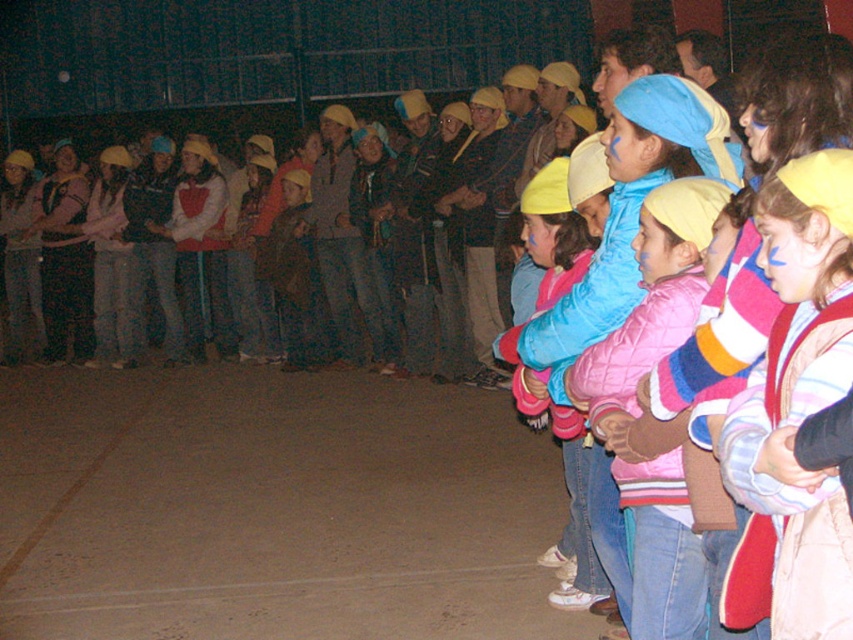
Is striped fleece jacket at center to the right of pink quilted jacket at center from the viewer's perspective?

Indeed, striped fleece jacket at center is positioned on the right side of pink quilted jacket at center.

What do you see at coordinates (795, 412) in the screenshot? The width and height of the screenshot is (853, 640). I see `striped fleece jacket at center` at bounding box center [795, 412].

The image size is (853, 640). I want to click on striped fleece jacket at center, so click(x=795, y=412).

Between matte blue jacket at center and brown concrete floor at lower center, which one appears on the right side from the viewer's perspective?

matte blue jacket at center

Is matte blue jacket at center taller than brown concrete floor at lower center?

Yes.

Consider the image. Who is more distant from viewer, (550, 230) or (65, 600)?

Positioned behind is point (65, 600).

Find the location of a particular element. matte blue jacket at center is located at coordinates (566, 488).

Is striped fleece jacket at center further to camera compared to matte blue jacket at center?

No, it is not.

Does striped fleece jacket at center lie in front of matte blue jacket at center?

Yes, striped fleece jacket at center is closer to the viewer.

Where is `striped fleece jacket at center`? Image resolution: width=853 pixels, height=640 pixels. striped fleece jacket at center is located at coordinates (795, 412).